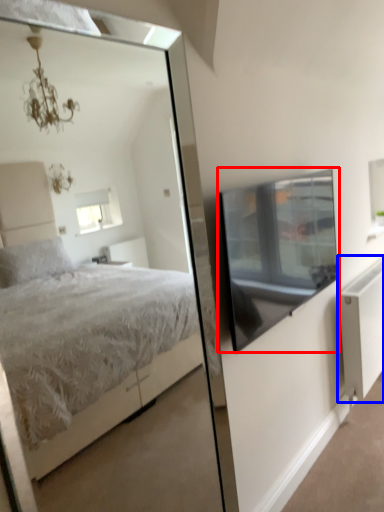
Question: Which point is closer to the camera, window screen (highlighted by a red box) or radiator (highlighted by a blue box)?

Choices:
 (A) window screen
 (B) radiator

Answer: (A)